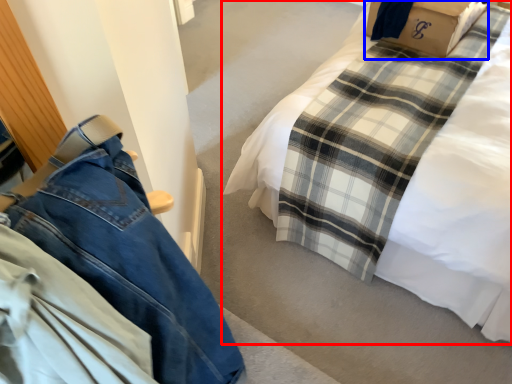
Question: Which of the following is the farthest to the observer, bed (highlighted by a red box) or cardboard box (highlighted by a blue box)?

Choices:
 (A) bed
 (B) cardboard box

Answer: (B)